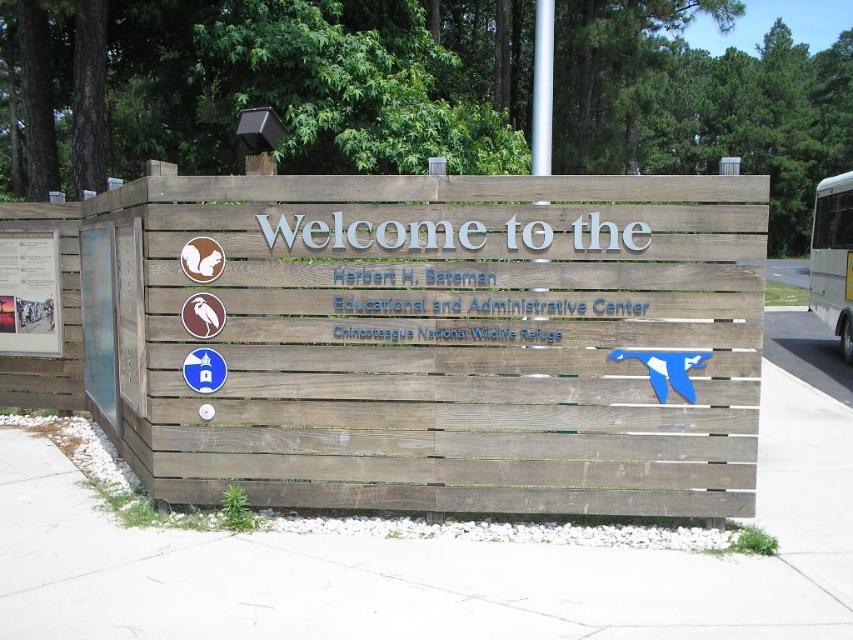
Who is shorter, white paper at left or wooden sign at left?

white paper at left

What do you see at coordinates (28, 292) in the screenshot? Image resolution: width=853 pixels, height=640 pixels. I see `white paper at left` at bounding box center [28, 292].

Identify the location of white paper at left. (28, 292).

Is wooden sign at left to the left of white glossy bus at right from the viewer's perspective?

Indeed, wooden sign at left is positioned on the left side of white glossy bus at right.

Who is positioned more to the right, wooden sign at left or white glossy bus at right?

white glossy bus at right

Is point (102, 362) behind point (819, 189)?

That is False.

Where is `wooden sign at left`? wooden sign at left is located at coordinates (99, 321).

Is white paper at left positioned at the back of white glossy bus at right?

No, it is not.

The image size is (853, 640). Find the location of `white paper at left`. white paper at left is located at coordinates coord(28,292).

Between point (57, 317) and point (820, 246), which one is positioned in front?

Point (57, 317)

Image resolution: width=853 pixels, height=640 pixels. Identify the location of white paper at left. (28, 292).